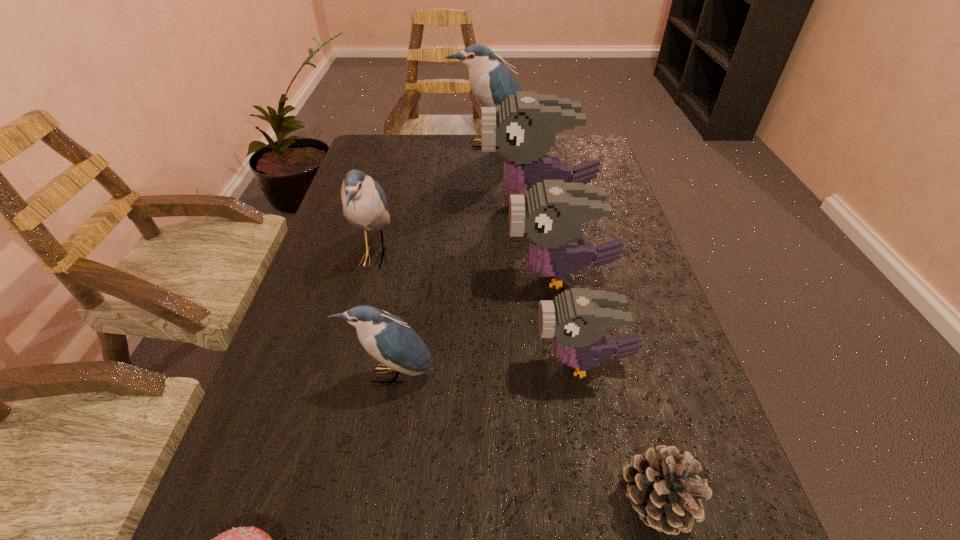
The height and width of the screenshot is (540, 960). Find the location of `object present at the far edge`. object present at the far edge is located at coordinates (491, 81).

At what (x,y) coordinates should I click in order to perform the action: click on vacant space at the far edge. Please return your answer as a coordinate pair (x, y). This screenshot has width=960, height=540. Looking at the image, I should click on (445, 134).

You are a GUI agent. You are given a task and a screenshot of the screen. Output one action in this format:
    pyautogui.click(x=<x>, y=<y>)
    Task: Click on the blank area at the left edge
    
    Given the screenshot: What is the action you would take?
    click(399, 191)

You are a GUI agent. You are given a task and a screenshot of the screen. Output one action in this format:
    pyautogui.click(x=<x>, y=<y>)
    Task: Click on the free point at the right edge
    This screenshot has height=540, width=960.
    Given the screenshot: What is the action you would take?
    pyautogui.click(x=656, y=374)

This screenshot has height=540, width=960. In order to click on free location at the far left corner of the desktop in this screenshot , I will do `click(390, 142)`.

Locate an element on the screen. The width and height of the screenshot is (960, 540). vacant space at the far right corner of the desktop is located at coordinates pyautogui.click(x=588, y=147).

Identify the location of vacant space that's between the smallest gray bird and the smallest blue bird. The height and width of the screenshot is (540, 960). (487, 369).

The image size is (960, 540). I want to click on free space between the second smallest blue bird and the farthest object, so click(x=432, y=200).

Locate an element on the screen. unoccupied area between the second farthest object and the nearest blue bird is located at coordinates (464, 288).

Identify which object is the seventh nearest to the farthest object. Please provide its 2D coordinates. Your answer should be formatted as a tuple, i.e. [(x, y)], where the tuple contains the x and y coordinates of a point satisfying the conditions above.

[(251, 539)]